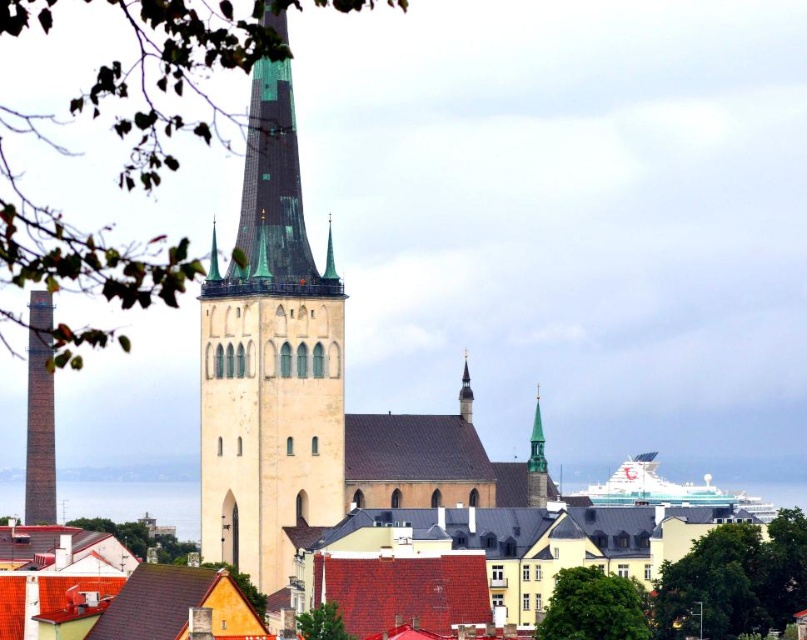
You are an architect analyzing the cityscape. You notice the beige stone tower at center and the green stone spire at upper center. Which of these two structures is larger in size?

The beige stone tower at center is bigger than the green stone spire at upper center according to the description.